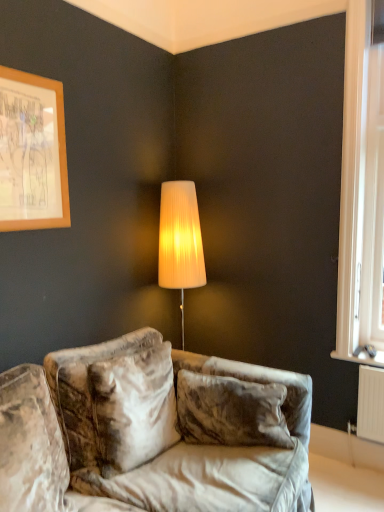
Question: Is velvet couch at lower center at the back of wooden frame at upper left?

Choices:
 (A) no
 (B) yes

Answer: (A)

Question: Does wooden frame at upper left have a greater width compared to velvet couch at lower center?

Choices:
 (A) no
 (B) yes

Answer: (A)

Question: From a real-world perspective, is wooden frame at upper left over velvet couch at lower center?

Choices:
 (A) no
 (B) yes

Answer: (B)

Question: Is wooden frame at upper left taller than velvet couch at lower center?

Choices:
 (A) yes
 (B) no

Answer: (B)

Question: Can you confirm if wooden frame at upper left is positioned to the left of velvet couch at lower center?

Choices:
 (A) yes
 (B) no

Answer: (A)

Question: Visually, is white plastic window at right positioned to the left or to the right of wooden frame at upper left?

Choices:
 (A) right
 (B) left

Answer: (A)

Question: From a real-world perspective, is white plastic window at right physically located above or below wooden frame at upper left?

Choices:
 (A) below
 (B) above

Answer: (A)

Question: From the image's perspective, relative to wooden frame at upper left, is white plastic window at right above or below?

Choices:
 (A) below
 (B) above

Answer: (A)

Question: In terms of width, does white plastic window at right look wider or thinner when compared to wooden frame at upper left?

Choices:
 (A) wide
 (B) thin

Answer: (A)

Question: Is white plastic window at right situated inside velvet couch at lower center or outside?

Choices:
 (A) outside
 (B) inside

Answer: (A)

Question: Is white plastic window at right to the left or to the right of velvet couch at lower center in the image?

Choices:
 (A) left
 (B) right

Answer: (B)

Question: From the image's perspective, is white plastic window at right positioned above or below velvet couch at lower center?

Choices:
 (A) below
 (B) above

Answer: (B)

Question: From their relative heights in the image, would you say white plastic window at right is taller or shorter than velvet couch at lower center?

Choices:
 (A) tall
 (B) short

Answer: (A)

Question: Which is correct: velvet couch at lower center is inside wooden frame at upper left, or outside of it?

Choices:
 (A) inside
 (B) outside

Answer: (B)

Question: From the image's perspective, is velvet couch at lower center above or below wooden frame at upper left?

Choices:
 (A) below
 (B) above

Answer: (A)